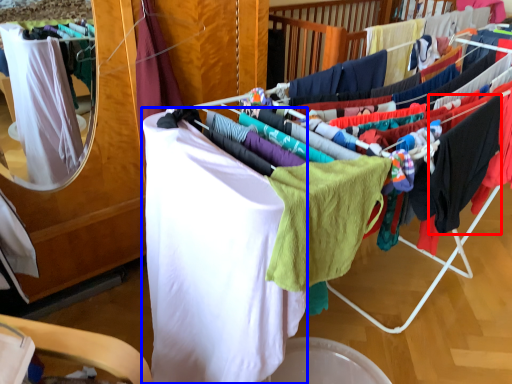
Question: Which point is further to the camera, clothing (highlighted by a red box) or clothing (highlighted by a blue box)?

Choices:
 (A) clothing
 (B) clothing

Answer: (A)